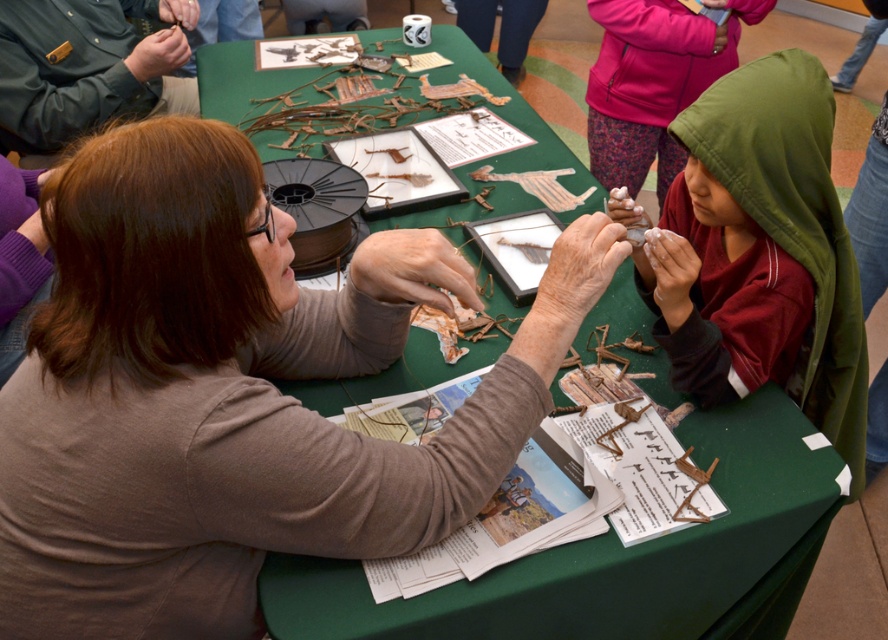
You are organizing an event and need to place a decorative ribbon exactly at the coordinates where the brown textured paper at center is located. What are the coordinates where you should place the ribbon?

The brown textured paper at center is located at point (232,394), so you should place the decorative ribbon at those coordinates.

You are a participant at this event and need to access both the brown textured paper at center and the green uniform at upper left. Which object is closer to you based on their positions?

The brown textured paper at center is closer to you because it is positioned in front of the green uniform at upper left.

You are attending an event and need to locate the registration desk. The registration desk has a green uniform at upper left and a green fabric table at center. According to the scene, which object is positioned to the right of the other?

The green fabric table at center is positioned to the right of the green uniform at upper left.